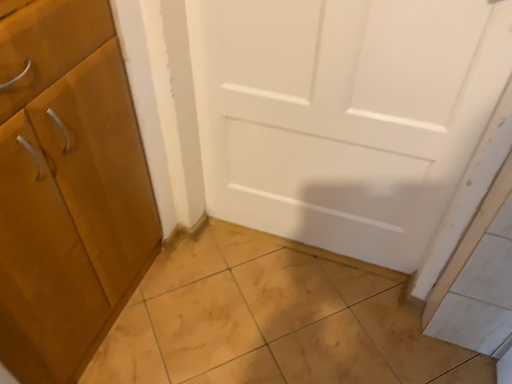
Image resolution: width=512 pixels, height=384 pixels. What are the coordinates of `free point above light brown tile at lower left (from a real-world perspective)` in the screenshot? It's located at (285, 324).